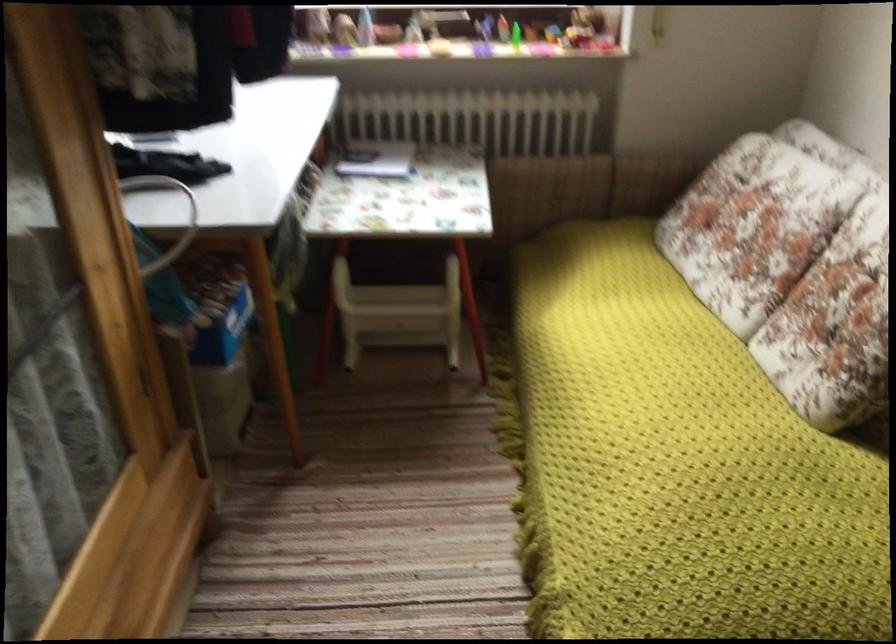
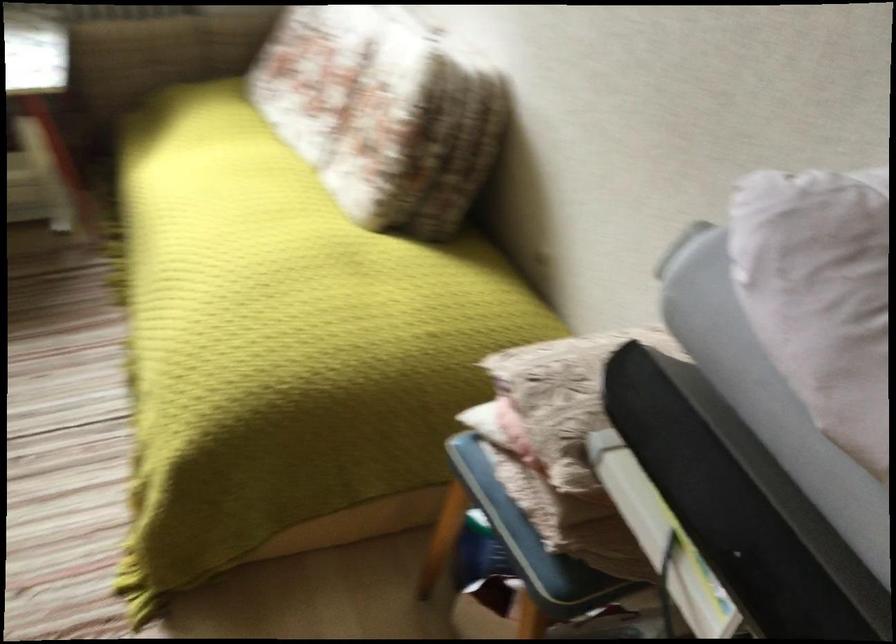
Which direction would the cameraman need to move to produce the second image?

The movement direction of the cameraman is right, backward.